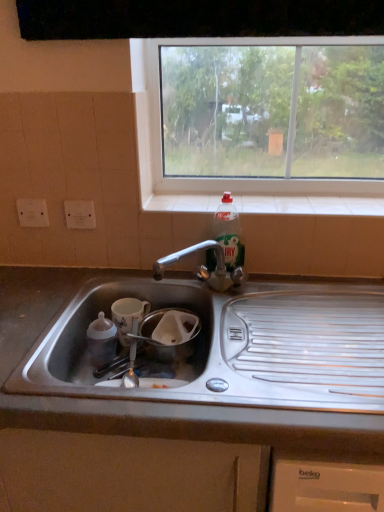
Identify the location of clear glass window at upper center. (209, 178).

The image size is (384, 512). What do you see at coordinates (229, 233) in the screenshot?
I see `translucent plastic bottle at upper right` at bounding box center [229, 233].

What are the coordinates of `translucent plastic bottle at upper right` in the screenshot? It's located at (229, 233).

Find the location of a particular element. This screenshot has width=384, height=512. clear glass window at upper center is located at coordinates 209,178.

Which is behind, point (243, 262) or point (190, 200)?

Point (190, 200)

From the image's perspective, is translucent plastic bottle at upper right over white tile at upper center?

No.

What's the angular difference between translucent plastic bottle at upper right and white tile at upper center's facing directions?

There is a 1.08-degree angle between the facing directions of translucent plastic bottle at upper right and white tile at upper center.

Considering the sizes of objects translucent plastic bottle at upper right and white tile at upper center in the image provided, who is wider, translucent plastic bottle at upper right or white tile at upper center?

With larger width is white tile at upper center.

Which object is positioned more to the right, white glossy mug at lower left or translucent plastic bottle at upper right?

translucent plastic bottle at upper right is more to the right.

Considering the sizes of objects white glossy mug at lower left and translucent plastic bottle at upper right in the image provided, who is thinner, white glossy mug at lower left or translucent plastic bottle at upper right?

translucent plastic bottle at upper right.

From a real-world perspective, which is physically above, white glossy mug at lower left or translucent plastic bottle at upper right?

translucent plastic bottle at upper right.

Does white glossy mug at lower left contain translucent plastic bottle at upper right?

No, translucent plastic bottle at upper right is located outside of white glossy mug at lower left.

Considering the points (79, 434) and (131, 298), which point is in front, point (79, 434) or point (131, 298)?

The point (79, 434) is more forward.

Considering the relative sizes of satin steel sink at lower center and white glossy mug at lower left in the image provided, is satin steel sink at lower center shorter than white glossy mug at lower left?

No.

In terms of width, does satin steel sink at lower center look wider or thinner when compared to white glossy mug at lower left?

satin steel sink at lower center is wider than white glossy mug at lower left.

Is satin steel sink at lower center turned away from white glossy mug at lower left?

Yes, satin steel sink at lower center is positioned with its back facing white glossy mug at lower left.

Consider the image. From the image's perspective, does translucent plastic bottle at upper right appear lower than satin steel sink at lower center?

Incorrect, from the image's perspective, translucent plastic bottle at upper right is higher than satin steel sink at lower center.

Is translucent plastic bottle at upper right to the left of satin steel sink at lower center from the viewer's perspective?

Incorrect, translucent plastic bottle at upper right is not on the left side of satin steel sink at lower center.

Can you see translucent plastic bottle at upper right touching satin steel sink at lower center?

No, translucent plastic bottle at upper right is not beside satin steel sink at lower center.

Locate an element on the screen. bottle behind the satin steel sink at lower center is located at coordinates (229, 233).

Consider the image. Between white tile at upper center and clear glass window at upper center, which one has larger width?

Wider between the two is white tile at upper center.

Is white tile at upper center shorter than clear glass window at upper center?

Indeed, white tile at upper center has a lesser height compared to clear glass window at upper center.

Does white tile at upper center contain clear glass window at upper center?

No.

Considering the relative sizes of white glossy mug at lower left and white tile at upper center in the image provided, is white glossy mug at lower left bigger than white tile at upper center?

Actually, white glossy mug at lower left might be smaller than white tile at upper center.

Does point (126, 303) appear closer or farther from the camera than point (297, 203)?

Point (126, 303) appears to be closer to the viewer than point (297, 203).

From a real-world perspective, is white glossy mug at lower left positioned under white tile at upper center based on gravity?

Yes, from a real-world perspective, white glossy mug at lower left is under white tile at upper center.

Considering the relative positions of white glossy mug at lower left and white tile at upper center in the image provided, is white glossy mug at lower left to the right of white tile at upper center from the viewer's perspective?

Incorrect, white glossy mug at lower left is not on the right side of white tile at upper center.

Is clear glass window at upper center surrounded by white glossy mug at lower left?

No, clear glass window at upper center is not a part of white glossy mug at lower left.

From a real-world perspective, is white glossy mug at lower left located higher than clear glass window at upper center?

No, from a real-world perspective, white glossy mug at lower left is not above clear glass window at upper center.

Considering the relative sizes of white glossy mug at lower left and clear glass window at upper center in the image provided, is white glossy mug at lower left taller than clear glass window at upper center?

In fact, white glossy mug at lower left may be shorter than clear glass window at upper center.

Between white glossy mug at lower left and clear glass window at upper center, which one has larger size?

With larger size is clear glass window at upper center.

This screenshot has height=512, width=384. I want to click on bottle in front of the white tile at upper center, so tap(229, 233).

What are the coordinates of `bottle above the white glossy mug at lower left (from the image's perspective)` in the screenshot? It's located at (229, 233).

From the image, which object appears to be farther from clear glass window at upper center, translucent plastic bottle at upper right or satin steel sink at lower center?

The object further to clear glass window at upper center is satin steel sink at lower center.

When comparing their distances from translucent plastic bottle at upper right, does white glossy mug at lower left or white tile at upper center seem further?

white glossy mug at lower left is further to translucent plastic bottle at upper right.

Consider the image. Considering their positions, is satin steel sink at lower center positioned closer to white tile at upper center than translucent plastic bottle at upper right?

Based on the image, translucent plastic bottle at upper right appears to be nearer to white tile at upper center.

When comparing their distances from white tile at upper center, does satin steel sink at lower center or clear glass window at upper center seem further?

Based on the image, satin steel sink at lower center appears to be further to white tile at upper center.

Considering their positions, is clear glass window at upper center positioned further to translucent plastic bottle at upper right than satin steel sink at lower center?

satin steel sink at lower center is positioned further to the anchor translucent plastic bottle at upper right.

Based on their spatial positions, is white tile at upper center or clear glass window at upper center closer to translucent plastic bottle at upper right?

Based on the image, white tile at upper center appears to be nearer to translucent plastic bottle at upper right.

Based on their spatial positions, is clear glass window at upper center or translucent plastic bottle at upper right closer to white glossy mug at lower left?

translucent plastic bottle at upper right.

Looking at the image, which one is located closer to satin steel sink at lower center, clear glass window at upper center or white tile at upper center?

Based on the image, white tile at upper center appears to be nearer to satin steel sink at lower center.

Locate an element on the screen. This screenshot has height=512, width=384. bottle that lies between clear glass window at upper center and satin steel sink at lower center from top to bottom is located at coordinates 229,233.

Identify the location of window sill between clear glass window at upper center and translucent plastic bottle at upper right in the up-down direction. (309, 205).

Locate an element on the screen. bottle between clear glass window at upper center and white glossy mug at lower left vertically is located at coordinates (229, 233).

Find the location of a particular element. The height and width of the screenshot is (512, 384). bottle between white tile at upper center and satin steel sink at lower center vertically is located at coordinates (229, 233).